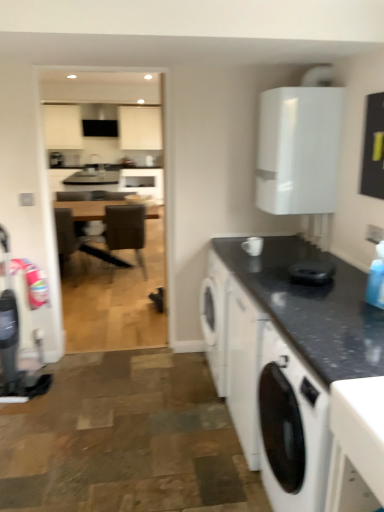
Question: Does brown wooden table at center come behind black granite countertop at lower right?

Choices:
 (A) no
 (B) yes

Answer: (B)

Question: Is brown wooden table at center to the left of black granite countertop at lower right from the viewer's perspective?

Choices:
 (A) yes
 (B) no

Answer: (A)

Question: Is brown wooden table at center wider than black granite countertop at lower right?

Choices:
 (A) no
 (B) yes

Answer: (B)

Question: Is brown wooden table at center at the right side of black granite countertop at lower right?

Choices:
 (A) yes
 (B) no

Answer: (B)

Question: Does brown wooden table at center lie in front of black granite countertop at lower right?

Choices:
 (A) yes
 (B) no

Answer: (B)

Question: Considering the positions of black glossy coffee cup at center, the second appliance from the left, and white matte washing machine at lower right in the image, is black glossy coffee cup at center, the second appliance from the left, wider or thinner than white matte washing machine at lower right?

Choices:
 (A) thin
 (B) wide

Answer: (A)

Question: From the image's perspective, relative to white matte washing machine at lower right, is black glossy coffee cup at center, which is the second appliance in back-to-front order, above or below?

Choices:
 (A) below
 (B) above

Answer: (B)

Question: Considering the positions of black glossy coffee cup at center, acting as the second appliance starting from the top, and white matte washing machine at lower right in the image, is black glossy coffee cup at center, acting as the second appliance starting from the top, taller or shorter than white matte washing machine at lower right?

Choices:
 (A) tall
 (B) short

Answer: (B)

Question: Is black glossy coffee cup at center, which is the second appliance in back-to-front order, in front of or behind white matte washing machine at lower right in the image?

Choices:
 (A) behind
 (B) front

Answer: (A)

Question: From a real-world perspective, relative to brown leather chair at center, is brown wooden table at center vertically above or below?

Choices:
 (A) below
 (B) above

Answer: (A)

Question: Considering the positions of point (152, 215) and point (109, 209), is point (152, 215) closer or farther from the camera than point (109, 209)?

Choices:
 (A) closer
 (B) farther

Answer: (B)

Question: Which is correct: brown wooden table at center is inside brown leather chair at center, or outside of it?

Choices:
 (A) outside
 (B) inside

Answer: (A)

Question: Based on their positions, is brown wooden table at center located to the left or right of brown leather chair at center?

Choices:
 (A) left
 (B) right

Answer: (A)

Question: Is white glossy cabinet at upper right inside the boundaries of white ceramic mug at upper center, the second appliance viewed from the front, or outside?

Choices:
 (A) outside
 (B) inside

Answer: (A)

Question: Relative to white ceramic mug at upper center, acting as the second appliance starting from the bottom, is white glossy cabinet at upper right in front or behind?

Choices:
 (A) front
 (B) behind

Answer: (A)